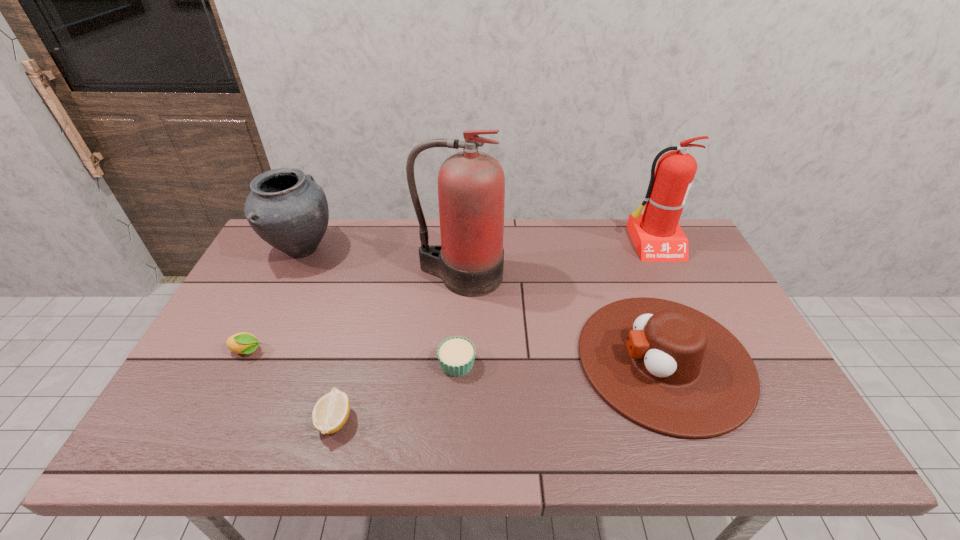
In the image, there is a desktop. Where is `vacant space at the far edge`? Image resolution: width=960 pixels, height=540 pixels. vacant space at the far edge is located at coordinates (418, 234).

This screenshot has width=960, height=540. Identify the location of free space at the left edge of the desktop. (219, 367).

Where is `free space at the right edge of the desktop`? This screenshot has width=960, height=540. free space at the right edge of the desktop is located at coordinates (691, 265).

Where is `vacant space at the far right corner of the desktop`? This screenshot has width=960, height=540. vacant space at the far right corner of the desktop is located at coordinates (697, 259).

Identify the location of vacant space at the near right corner of the desktop. The image size is (960, 540). (774, 446).

Locate an element on the screen. Image resolution: width=960 pixels, height=540 pixels. vacant area that lies between the cowboy hat and the urn is located at coordinates (483, 305).

Locate an element on the screen. free point between the cupcake and the shorter lemon is located at coordinates (396, 392).

Where is `free space that is in between the fifth object from right to left and the sixth shortest object`? This screenshot has width=960, height=540. free space that is in between the fifth object from right to left and the sixth shortest object is located at coordinates (493, 332).

Identify the location of empty space that is in between the cupcake and the third object from left to right. The image size is (960, 540). (396, 392).

Locate an element on the screen. vacant space that is in between the farther lemon and the tallest object is located at coordinates (353, 314).